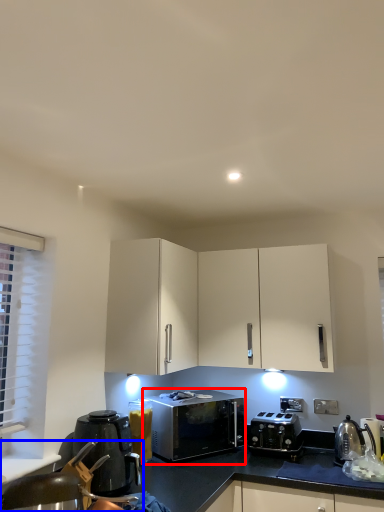
Question: Which point is closer to the camera, microwave oven (highlighted by a red box) or swivel chair (highlighted by a blue box)?

Choices:
 (A) microwave oven
 (B) swivel chair

Answer: (B)